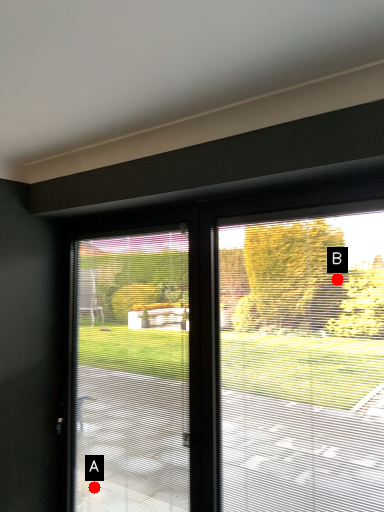
Question: Two points are circled on the image, labeled by A and B beside each circle. Which of the following is the closest to the observer?

Choices:
 (A) A is closer
 (B) B is closer

Answer: (A)